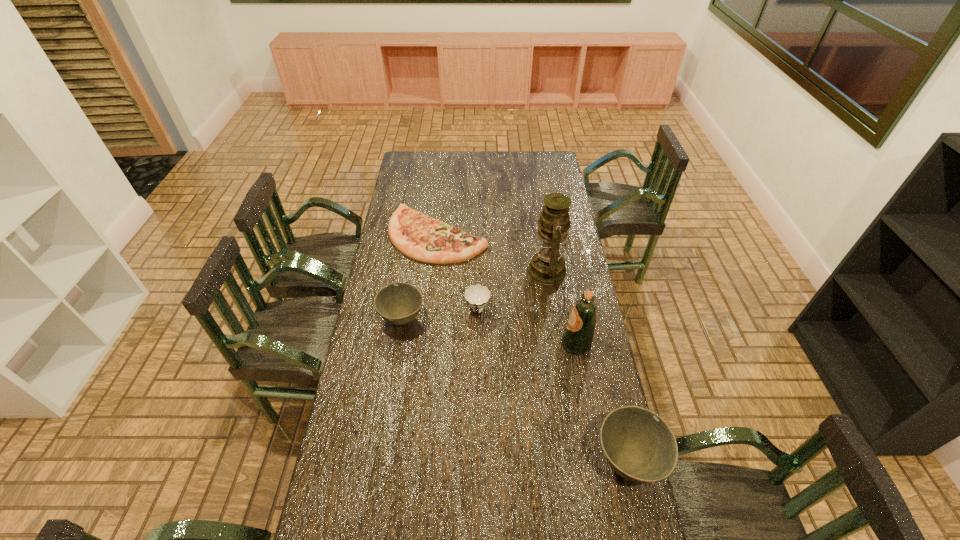
Find the location of a particular element. vacant space located on the left of the oil lamp is located at coordinates point(508,271).

Locate an element on the screen. Image resolution: width=960 pixels, height=540 pixels. free space located on the right of the pizza is located at coordinates (514, 235).

I want to click on vacant space located 0.350m on the side of the second shortest object with the handle, so click(x=477, y=406).

Find the location of a particular element. The width and height of the screenshot is (960, 540). vacant area situated on the front-facing side of the olive oil is located at coordinates (471, 344).

Locate an element on the screen. This screenshot has height=540, width=960. free space located 0.280m on the front-facing side of the olive oil is located at coordinates (488, 344).

Identify the location of free location located on the front-facing side of the olive oil. (467, 344).

Identify the location of object that is at the near edge. This screenshot has height=540, width=960. (638, 445).

At what (x,y) coordinates should I click in order to perform the action: click on bowl at the left edge. Please return your answer as a coordinate pair (x, y). The width and height of the screenshot is (960, 540). Looking at the image, I should click on (398, 303).

The height and width of the screenshot is (540, 960). What are the coordinates of `pizza that is at the left edge` in the screenshot? It's located at (422, 238).

I want to click on bowl that is at the right edge, so click(638, 445).